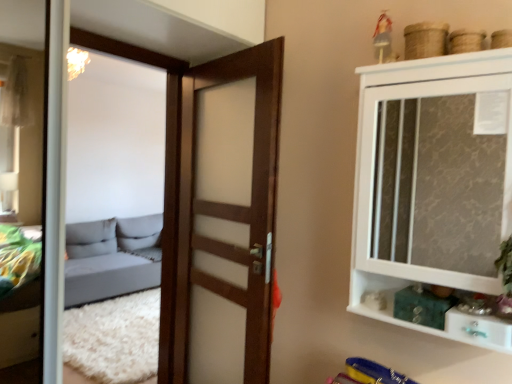
Question: From the image's perspective, is white glossy drawer at lower right below white glossy cupboard at upper right?

Choices:
 (A) no
 (B) yes

Answer: (B)

Question: Is white glossy drawer at lower right aimed at white glossy cupboard at upper right?

Choices:
 (A) no
 (B) yes

Answer: (B)

Question: Does white glossy drawer at lower right have a greater height compared to white glossy cupboard at upper right?

Choices:
 (A) yes
 (B) no

Answer: (B)

Question: Is white glossy drawer at lower right in front of white glossy cupboard at upper right?

Choices:
 (A) no
 (B) yes

Answer: (A)

Question: Can you confirm if white glossy drawer at lower right is shorter than white glossy cupboard at upper right?

Choices:
 (A) yes
 (B) no

Answer: (A)

Question: Does white glossy drawer at lower right have a lesser width compared to white glossy cupboard at upper right?

Choices:
 (A) yes
 (B) no

Answer: (A)

Question: Would you say white glossy cupboard at upper right is outside wooden door at center?

Choices:
 (A) no
 (B) yes

Answer: (B)

Question: Is white glossy cupboard at upper right smaller than wooden door at center?

Choices:
 (A) no
 (B) yes

Answer: (A)

Question: Is white glossy cupboard at upper right beside wooden door at center?

Choices:
 (A) no
 (B) yes

Answer: (A)

Question: Is white glossy cupboard at upper right positioned behind wooden door at center?

Choices:
 (A) yes
 (B) no

Answer: (B)

Question: Considering the relative sizes of white glossy cupboard at upper right and wooden door at center in the image provided, is white glossy cupboard at upper right wider than wooden door at center?

Choices:
 (A) yes
 (B) no

Answer: (A)

Question: From the image's perspective, would you say white glossy cupboard at upper right is positioned over wooden door at center?

Choices:
 (A) yes
 (B) no

Answer: (A)

Question: From the image's perspective, is wooden door at center below white glossy cupboard at upper right?

Choices:
 (A) no
 (B) yes

Answer: (B)